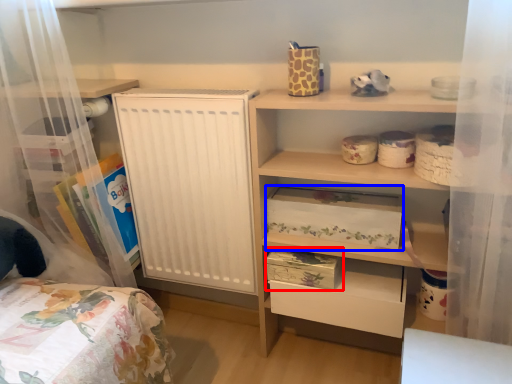
Question: Which point is further to the camera, storage box (highlighted by a red box) or storage box (highlighted by a blue box)?

Choices:
 (A) storage box
 (B) storage box

Answer: (A)